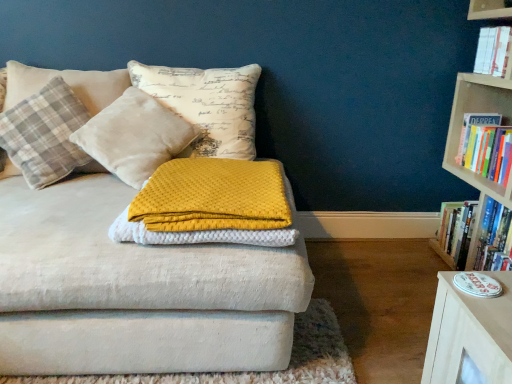
Question: Is plaid fabric pillow at left, which is the first pillow from left to right, inside or outside of hardcover book at right, the second book from the bottom?

Choices:
 (A) inside
 (B) outside

Answer: (B)

Question: Considering the positions of plaid fabric pillow at left, which is the first pillow from left to right, and hardcover book at right, the second book from the bottom, in the image, is plaid fabric pillow at left, which is the first pillow from left to right, wider or thinner than hardcover book at right, the second book from the bottom,?

Choices:
 (A) wide
 (B) thin

Answer: (A)

Question: Estimate the real-world distances between objects in this image. Which object is closer to the hardcover book at right, placed as the third book when sorted from top to bottom?

Choices:
 (A) wooden bookcase at right
 (B) yellow textured blanket at center
 (C) velvet cushion at upper left, the 1th pillow positioned from the right
 (D) plaid fabric pillow at left, which appears as the second pillow when viewed from the right
 (E) white paper book at upper right, the third book positioned from the bottom

Answer: (A)

Question: Estimate the real-world distances between objects in this image. Which object is closer to the velvet cushion at upper left, the 1th pillow positioned from the right?

Choices:
 (A) wooden bookcase at right
 (B) hardcover book at right, the second book from the bottom
 (C) yellow textured blanket at center
 (D) white paper book at upper right, the third book positioned from the bottom
 (E) hardcover book at right, placed as the third book when sorted from top to bottom

Answer: (C)